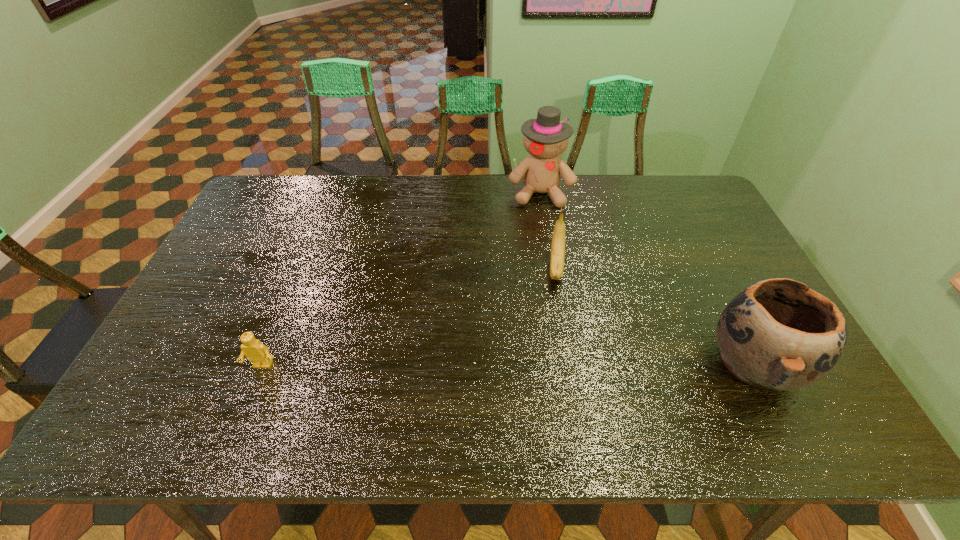
Locate an element on the screen. Image resolution: width=960 pixels, height=540 pixels. blank space located 0.240m at the start of the peel on the second shortest object is located at coordinates (557, 360).

You are a GUI agent. You are given a task and a screenshot of the screen. Output one action in this format:
    pyautogui.click(x=<x>, y=<y>)
    Task: Click on the vacant space situated 0.110m at the start of the peel on the second shortest object
    This screenshot has width=960, height=540.
    Given the screenshot: What is the action you would take?
    pyautogui.click(x=558, y=319)

The height and width of the screenshot is (540, 960). I want to click on free spot located 0.320m on the front-facing side of the rag_doll, so click(x=546, y=278).

Image resolution: width=960 pixels, height=540 pixels. I want to click on free space located 0.270m on the front-facing side of the rag_doll, so [x=545, y=266].

Find the location of a particular element. vacant area situated 0.240m on the front-facing side of the rag_doll is located at coordinates (545, 259).

Identify the location of object at the far edge. The width and height of the screenshot is (960, 540). (545, 138).

Locate an element on the screen. The width and height of the screenshot is (960, 540). Lego present at the near edge is located at coordinates (256, 352).

Find the location of a particular element. pottery that is at the near edge is located at coordinates (779, 334).

Find the location of a particular element. This screenshot has height=540, width=960. object that is at the right edge is located at coordinates (779, 334).

Locate an element on the screen. Image resolution: width=960 pixels, height=540 pixels. object at the near right corner is located at coordinates (779, 334).